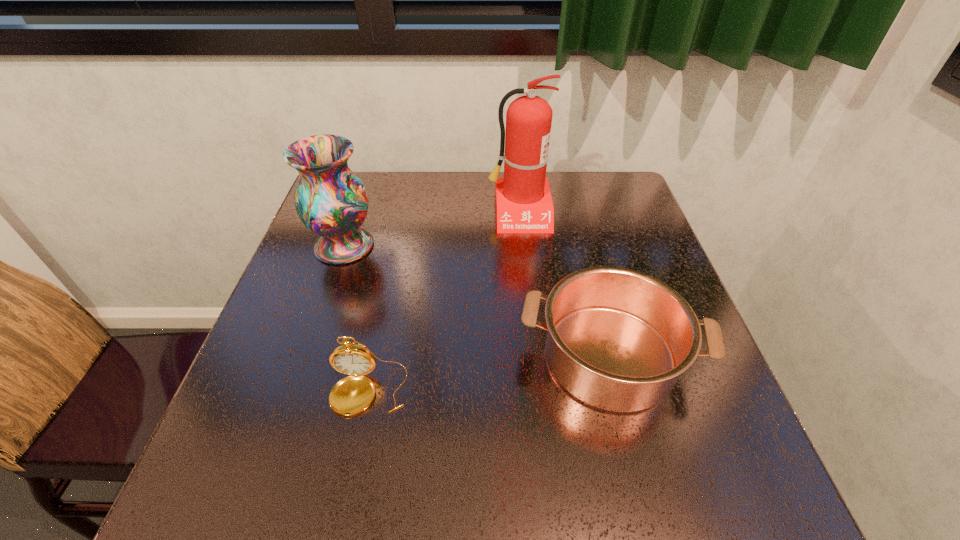
Choose which object is the nearest neighbor to the saucepan. Please provide its 2D coordinates. Your answer should be formatted as a tuple, i.e. [(x, y)], where the tuple contains the x and y coordinates of a point satisfying the conditions above.

[(352, 394)]

Where is `object that ranks as the second closest to the fire extinguisher`? This screenshot has width=960, height=540. object that ranks as the second closest to the fire extinguisher is located at coordinates [x=331, y=201].

I want to click on vacant space that satisfies the following two spatial constraints: 1. on the front-facing side of the tallest object; 2. on the left side of the saucepan, so click(x=535, y=356).